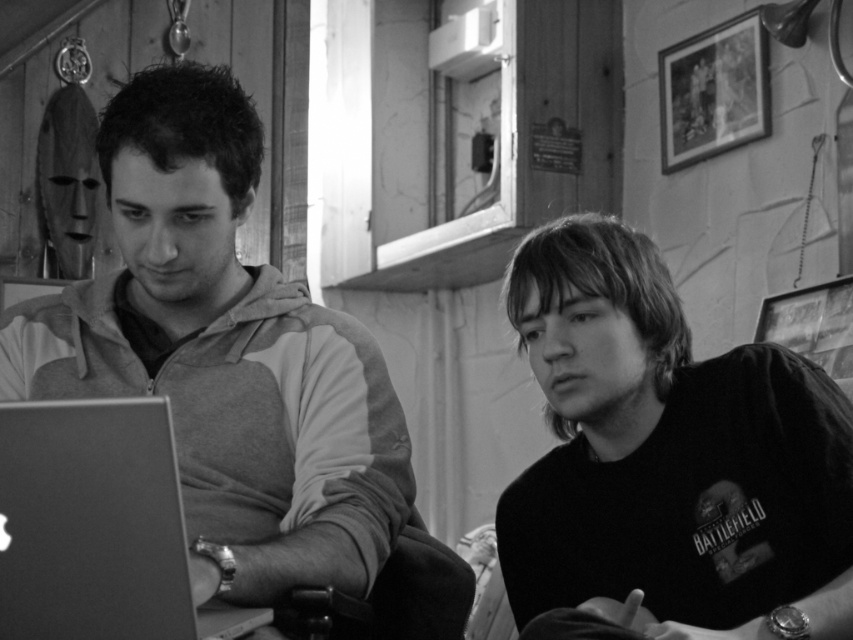
Is the position of smooth black shirt at right less distant than that of metallic silver laptop at left?

No.

Who is more distant from viewer, (619,596) or (148,560)?

Point (619,596)

Is point (624, 284) closer to camera compared to point (102, 513)?

No, it is not.

Where is `smooth black shirt at right`? Image resolution: width=853 pixels, height=640 pixels. smooth black shirt at right is located at coordinates (670, 456).

Does matte gray hoodie at left have a greater height compared to metallic silver laptop at left?

Yes.

Who is taller, matte gray hoodie at left or metallic silver laptop at left?

matte gray hoodie at left

This screenshot has width=853, height=640. I want to click on matte gray hoodie at left, so click(x=224, y=355).

The width and height of the screenshot is (853, 640). In order to click on matte gray hoodie at left in this screenshot , I will do `click(224, 355)`.

Who is shorter, matte gray hoodie at left or smooth black shirt at right?

smooth black shirt at right is shorter.

Is matte gray hoodie at left above smooth black shirt at right?

Indeed, matte gray hoodie at left is positioned over smooth black shirt at right.

Describe the element at coordinates (224, 355) in the screenshot. I see `matte gray hoodie at left` at that location.

Find the location of a particular element. This screenshot has width=853, height=640. matte gray hoodie at left is located at coordinates (224, 355).